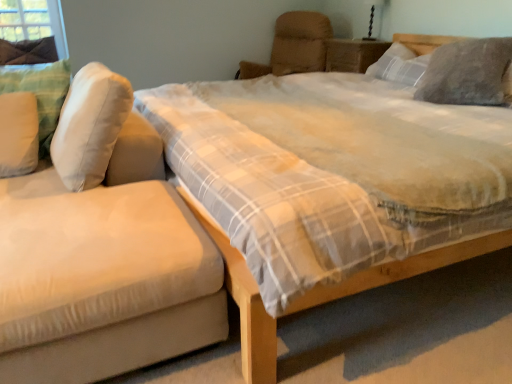
Question: From the image's perspective, is white soft pillow at left, positioned as the first pillow in left-to-right order, on green fabric at upper left?

Choices:
 (A) yes
 (B) no

Answer: (B)

Question: Is white soft pillow at left, which is counted as the 4th pillow, starting from the right, in front of green fabric at upper left?

Choices:
 (A) yes
 (B) no

Answer: (A)

Question: From a real-world perspective, is white soft pillow at left, positioned as the first pillow in left-to-right order, located beneath green fabric at upper left?

Choices:
 (A) yes
 (B) no

Answer: (A)

Question: Is white soft pillow at left, which is counted as the 4th pillow, starting from the right, outside green fabric at upper left?

Choices:
 (A) yes
 (B) no

Answer: (A)

Question: Considering the relative positions of white soft pillow at left, positioned as the first pillow in left-to-right order, and green fabric at upper left in the image provided, is white soft pillow at left, positioned as the first pillow in left-to-right order, to the left of green fabric at upper left from the viewer's perspective?

Choices:
 (A) no
 (B) yes

Answer: (A)

Question: From the image's perspective, is black glass table lamp at upper right on white soft pillow at left, which is counted as the 4th pillow, starting from the right?

Choices:
 (A) yes
 (B) no

Answer: (A)

Question: Considering the relative sizes of black glass table lamp at upper right and white soft pillow at left, which is counted as the 4th pillow, starting from the right, in the image provided, is black glass table lamp at upper right thinner than white soft pillow at left, which is counted as the 4th pillow, starting from the right,?

Choices:
 (A) no
 (B) yes

Answer: (B)

Question: Can you confirm if black glass table lamp at upper right is shorter than white soft pillow at left, which is counted as the 4th pillow, starting from the right?

Choices:
 (A) no
 (B) yes

Answer: (B)

Question: Is black glass table lamp at upper right next to white soft pillow at left, which is counted as the 4th pillow, starting from the right?

Choices:
 (A) yes
 (B) no

Answer: (B)

Question: Considering the relative sizes of black glass table lamp at upper right and white soft pillow at left, positioned as the first pillow in left-to-right order, in the image provided, is black glass table lamp at upper right bigger than white soft pillow at left, positioned as the first pillow in left-to-right order,?

Choices:
 (A) yes
 (B) no

Answer: (B)

Question: From a real-world perspective, does black glass table lamp at upper right sit lower than white soft pillow at left, which is counted as the 4th pillow, starting from the right?

Choices:
 (A) no
 (B) yes

Answer: (A)

Question: From the image's perspective, is suede-like beige studio couch at left below wooden nightstand at upper center?

Choices:
 (A) yes
 (B) no

Answer: (A)